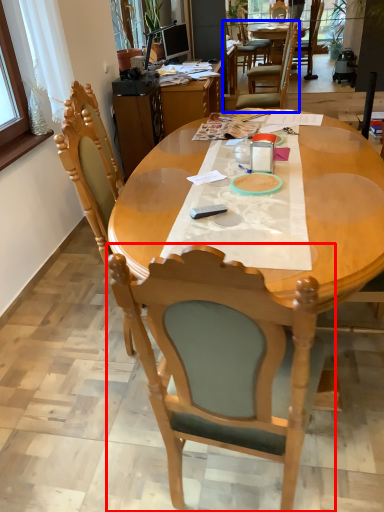
Question: Which object is further to the camera taking this photo, chair (highlighted by a red box) or chair (highlighted by a blue box)?

Choices:
 (A) chair
 (B) chair

Answer: (B)